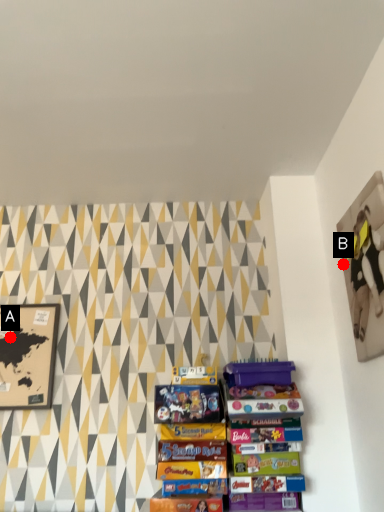
Question: Two points are circled on the image, labeled by A and B beside each circle. Which point is farther from the camera taking this photo?

Choices:
 (A) A is further
 (B) B is further

Answer: (A)